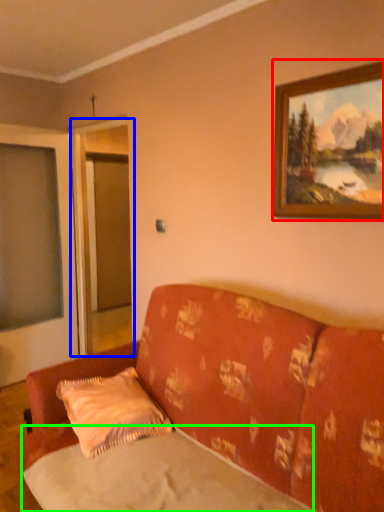
Question: Which object is positioned closest to picture frame (highlighted by a red box)? Select from screen door (highlighted by a blue box) and sheet (highlighted by a green box).

Choices:
 (A) screen door
 (B) sheet

Answer: (B)